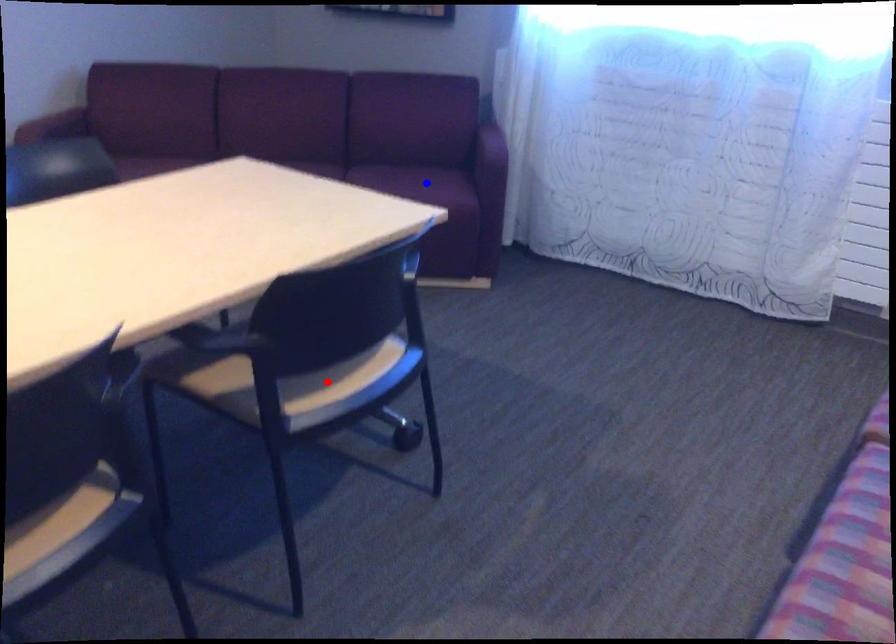
Question: In the image, two points are highlighted. Which point is nearer to the camera? Reply with the corresponding letter.

Choices:
 (A) blue point
 (B) red point

Answer: (B)